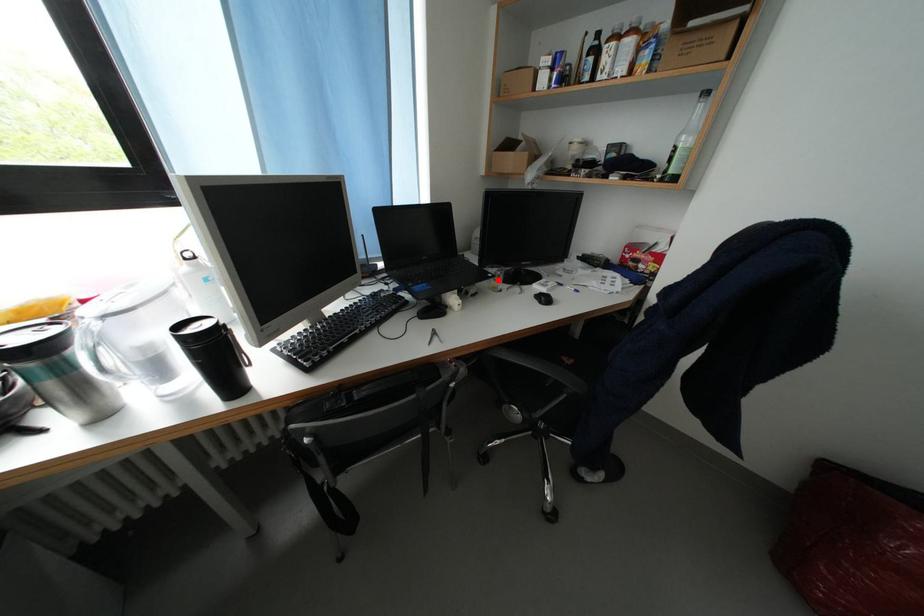
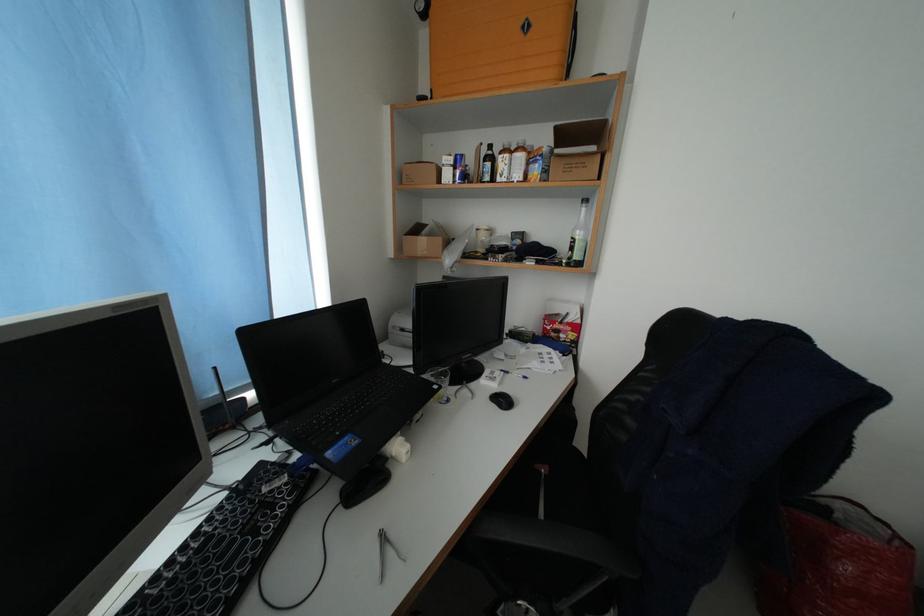
Question: I am providing you with two images of the same scene from different viewpoints. A red point is marked on the first image. At the location where the point appears in image 1, is it still visible in image 2?

Choices:
 (A) Yes
 (B) No

Answer: (A)